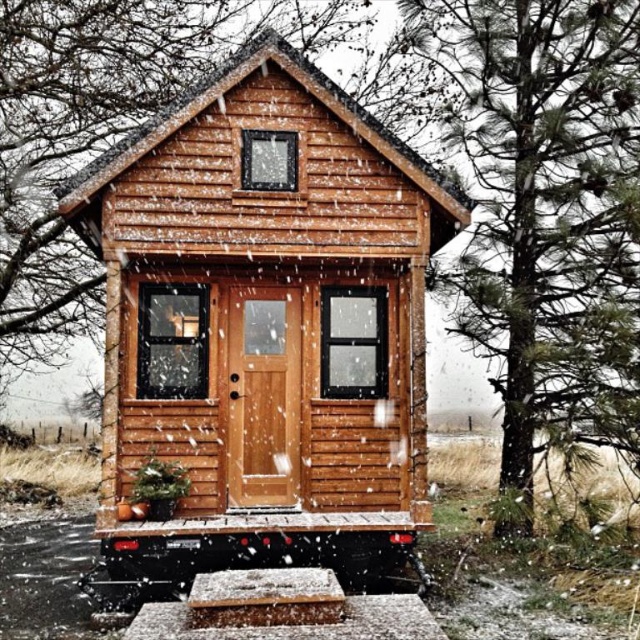
What are the coordinates of the matte wood log cabin at center?

The coordinates of the matte wood log cabin at center are at point (262, 324).

Based on the photo, you are standing in front of the cabin and want to take a photo of both the matte wood log cabin at center and the green pine tree at right. Which object should you focus on first to ensure both are in clear view?

You should focus on the matte wood log cabin at center first because it is closer to you than the green pine tree at right, ensuring both are in focus when capturing the scene.

You are standing in front of the cabin and want to determine the relative positions of two points marked on the cabin. The first point is at coordinates point (328, 348) and the second is at point (525, 364). Based on the cabin structure, which point is closer to you?

Point (328, 348) is closer to the camera than point (525, 364).